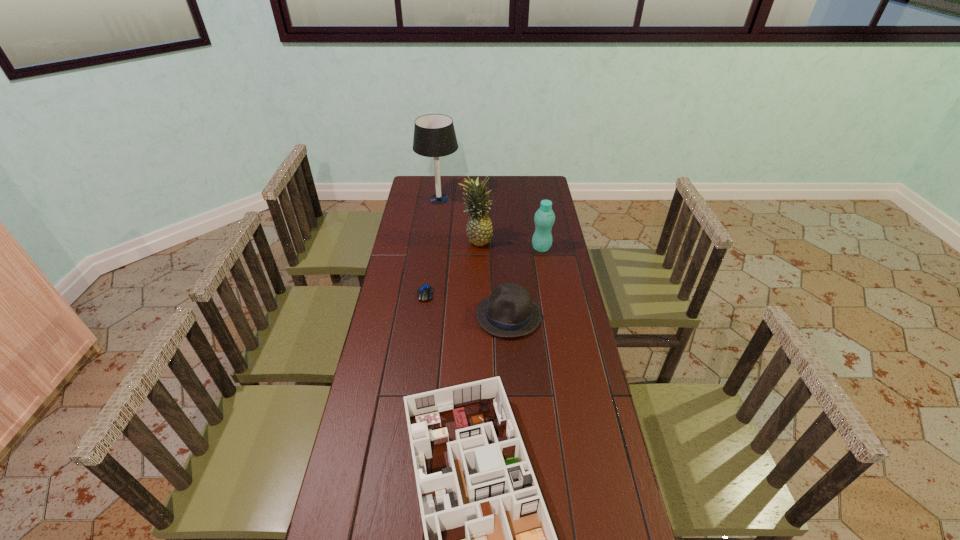
Locate an element on the screen. This screenshot has height=540, width=960. the farthest object is located at coordinates (434, 135).

The height and width of the screenshot is (540, 960). In order to click on the tallest object in this screenshot , I will do `click(434, 135)`.

Find the location of a particular element. Image resolution: width=960 pixels, height=540 pixels. the fifth shortest object is located at coordinates (479, 230).

Find the location of `the third tallest object`. the third tallest object is located at coordinates (544, 218).

Locate an element on the screen. bowler hat is located at coordinates (509, 312).

I want to click on computer mouse, so click(x=424, y=293).

Locate an element on the screen. vacant space located 0.170m on the front of the farthest object is located at coordinates (435, 231).

Locate an element on the screen. This screenshot has height=540, width=960. vacant space located on the back of the fifth shortest object is located at coordinates (477, 201).

Where is `blank area located 0.050m on the right of the fourth shortest object`? blank area located 0.050m on the right of the fourth shortest object is located at coordinates (563, 248).

Where is `free spot located 0.270m on the front-facing side of the bowler hat`? Image resolution: width=960 pixels, height=540 pixels. free spot located 0.270m on the front-facing side of the bowler hat is located at coordinates (402, 315).